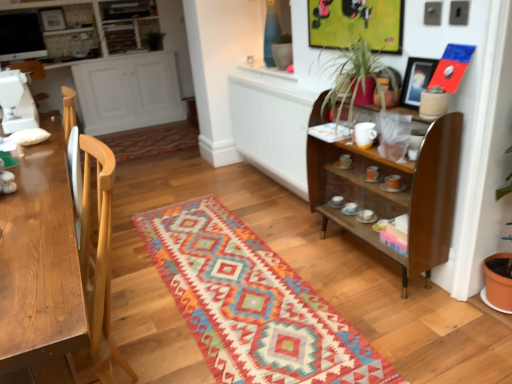
Measure the distance between point (356, 87) and camera.

Point (356, 87) is 6.58 feet from camera.

This screenshot has width=512, height=384. What do you see at coordinates (395, 193) in the screenshot? I see `glossy wood shelf at upper right` at bounding box center [395, 193].

How much space does white wood cabinet at left, which is the second cabinetry in top-to-bottom order, occupy vertically?

84.36 centimeters.

The image size is (512, 384). Describe the element at coordinates (252, 303) in the screenshot. I see `multicolored woven mat at center` at that location.

Identify the location of green leafy plant at upper right. This screenshot has width=512, height=384. (357, 79).

Is light wood desk at left turned away from green leafy plant at upper right?

No, light wood desk at left is not facing away from green leafy plant at upper right.

Considering the sizes of objects light wood desk at left and green leafy plant at upper right in the image provided, who is shorter, light wood desk at left or green leafy plant at upper right?

Standing shorter between the two is green leafy plant at upper right.

Which object is positioned more to the left, light wood desk at left or green leafy plant at upper right?

light wood desk at left is more to the left.

Considering the sizes of multicolored woven mat at center and glossy wood shelf at upper right in the image, is multicolored woven mat at center taller or shorter than glossy wood shelf at upper right?

In the image, multicolored woven mat at center appears to be shorter than glossy wood shelf at upper right.

Considering the sizes of objects multicolored woven mat at center and glossy wood shelf at upper right in the image provided, who is smaller, multicolored woven mat at center or glossy wood shelf at upper right?

With smaller size is multicolored woven mat at center.

Where is `shelf above the multicolored woven mat at center (from a real-world perspective)`? Image resolution: width=512 pixels, height=384 pixels. shelf above the multicolored woven mat at center (from a real-world perspective) is located at coordinates (395, 193).

Is matte black picture frame at upper right to the left or to the right of green leafy plant at upper center in the image?

matte black picture frame at upper right is to the right of green leafy plant at upper center.

From a real-world perspective, is matte black picture frame at upper right on green leafy plant at upper center?

Actually, matte black picture frame at upper right is physically below green leafy plant at upper center in the real world.

Would you say matte black picture frame at upper right is a long distance from green leafy plant at upper center?

That's right, there is a large distance between matte black picture frame at upper right and green leafy plant at upper center.

Would you say green leafy plant at upper center is part of matte black picture frame at upper right's contents?

No, matte black picture frame at upper right does not contain green leafy plant at upper center.

Measure the distance from white glossy cabinet at upper left, acting as the first cabinetry starting from the top, to green leafy plant at upper center.

18.59 inches.

Is green leafy plant at upper center completely or partially inside white glossy cabinet at upper left, acting as the first cabinetry starting from the top?

That's correct, green leafy plant at upper center is inside white glossy cabinet at upper left, acting as the first cabinetry starting from the top.

Is white glossy cabinet at upper left, acting as the first cabinetry starting from the top, directly adjacent to green leafy plant at upper center?

white glossy cabinet at upper left, acting as the first cabinetry starting from the top, and green leafy plant at upper center are not in contact.

Is point (131, 52) in front of point (146, 43)?

Yes, point (131, 52) is in front of point (146, 43).

Between green leafy plant at upper center and green leafy plant at upper right, which one is positioned behind?

green leafy plant at upper center is further away from the camera.

Is point (157, 39) positioned after point (357, 95)?

Yes, point (157, 39) is behind point (357, 95).

Does green leafy plant at upper center touch green leafy plant at upper right?

No, green leafy plant at upper center is not in contact with green leafy plant at upper right.

Does glossy wood shelf at upper right have a greater width compared to multicolored woven mat at center?

No, glossy wood shelf at upper right is not wider than multicolored woven mat at center.

Would you say multicolored woven mat at center is part of glossy wood shelf at upper right's contents?

No, multicolored woven mat at center is not surrounded by glossy wood shelf at upper right.

Between point (320, 157) and point (397, 378), which one is positioned behind?

The point (320, 157) is farther.

Does light wood desk at left appear on the left side of green leafy plant at upper center?

No.

From the image's perspective, is light wood desk at left beneath green leafy plant at upper center?

Correct, light wood desk at left appears lower than green leafy plant at upper center in the image.

Which object is closer to the camera taking this photo, light wood desk at left or green leafy plant at upper center?

light wood desk at left is closer to the camera.

You are a GUI agent. You are given a task and a screenshot of the screen. Output one action in this format:
    pyautogui.click(x=<x>, y=<y>)
    Task: Click on the houseplant above the light wood desk at left (from the image's perspective)
    The height and width of the screenshot is (384, 512).
    Given the screenshot: What is the action you would take?
    pyautogui.click(x=357, y=79)

Find the location of a particular element. This screenshot has width=512, height=384. shelf located on the right of multicolored woven mat at center is located at coordinates (395, 193).

Looking at this image, which object lies further to the anchor point multicolored woven mat at center, matte black picture frame at upper right or green leafy plant at upper center?

Among the two, green leafy plant at upper center is located further to multicolored woven mat at center.

Considering their positions, is light wood desk at left positioned closer to white glossy cabinet at upper left, the second cabinetry when ordered from bottom to top, than green leafy plant at upper right?

green leafy plant at upper right.

Based on their spatial positions, is multicolored woven mat at center or light wood desk at left closer to green leafy plant at upper right?

Based on the image, multicolored woven mat at center appears to be nearer to green leafy plant at upper right.

Considering their positions, is green leafy plant at upper right positioned further to green leafy plant at upper center than light wood desk at left?

Based on the image, light wood desk at left appears to be further to green leafy plant at upper center.

Looking at the image, which one is located closer to glossy wood shelf at upper right, green leafy plant at upper right or multicolored woven mat at center?

The object closer to glossy wood shelf at upper right is green leafy plant at upper right.

Considering their positions, is multicolored woven mat at center positioned further to matte black picture frame at upper right than green leafy plant at upper right?

The object further to matte black picture frame at upper right is multicolored woven mat at center.

From the image, which object appears to be nearer to matte black picture frame at upper right, glossy wood shelf at upper right or light wood desk at left?

glossy wood shelf at upper right.

When comparing their distances from matte black picture frame at upper right, does white wood cabinet at left, which is the second cabinetry in top-to-bottom order, or green leafy plant at upper center seem closer?

white wood cabinet at left, which is the second cabinetry in top-to-bottom order, lies closer to matte black picture frame at upper right than the other object.

Where is `picture frame between green leafy plant at upper right and glossy wood shelf at upper right from top to bottom`? picture frame between green leafy plant at upper right and glossy wood shelf at upper right from top to bottom is located at coordinates (416, 80).

In order to click on picture frame located between green leafy plant at upper right and white wood cabinet at left, which ranks as the first cabinetry in bottom-to-top order, in the depth direction in this screenshot , I will do `click(416, 80)`.

Locate an element on the screen. The width and height of the screenshot is (512, 384). mat between light wood desk at left and glossy wood shelf at upper right is located at coordinates (252, 303).

Locate an element on the screen. This screenshot has width=512, height=384. picture frame between light wood desk at left and white wood cabinet at left, which ranks as the first cabinetry in bottom-to-top order, along the z-axis is located at coordinates (416, 80).